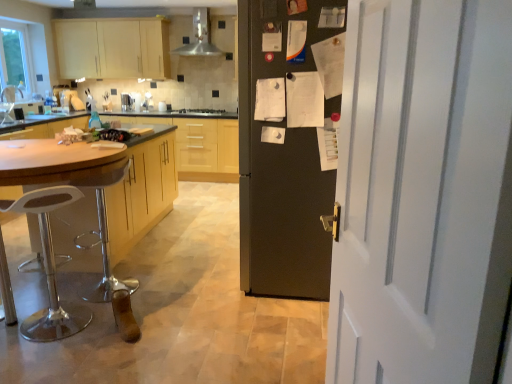
Where is `vacant space in between matte black fridge at center and white plastic bar stool at left`? The image size is (512, 384). vacant space in between matte black fridge at center and white plastic bar stool at left is located at coordinates (196, 295).